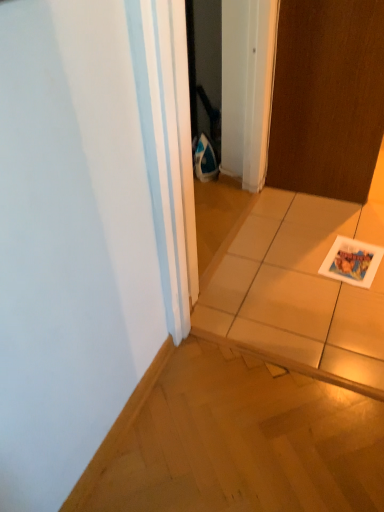
Question: From the image's perspective, is white glossy postcard at lower right located beneath white glossy tile at center?

Choices:
 (A) no
 (B) yes

Answer: (B)

Question: Could you tell me if white glossy postcard at lower right is turned towards white glossy tile at center?

Choices:
 (A) no
 (B) yes

Answer: (B)

Question: Is white glossy postcard at lower right taller than white glossy tile at center?

Choices:
 (A) yes
 (B) no

Answer: (B)

Question: Is white glossy postcard at lower right completely or partially outside of white glossy tile at center?

Choices:
 (A) yes
 (B) no

Answer: (B)

Question: From the image's perspective, is white glossy postcard at lower right above white glossy tile at center?

Choices:
 (A) yes
 (B) no

Answer: (B)

Question: Is white glossy tile at center surrounded by white glossy postcard at lower right?

Choices:
 (A) no
 (B) yes

Answer: (A)

Question: Is brown matte door at upper right smaller than white glossy tile at center?

Choices:
 (A) yes
 (B) no

Answer: (A)

Question: Can we say brown matte door at upper right lies outside white glossy tile at center?

Choices:
 (A) no
 (B) yes

Answer: (B)

Question: Is brown matte door at upper right oriented towards white glossy tile at center?

Choices:
 (A) no
 (B) yes

Answer: (B)

Question: From a real-world perspective, is brown matte door at upper right beneath white glossy tile at center?

Choices:
 (A) no
 (B) yes

Answer: (A)

Question: Is the surface of brown matte door at upper right in direct contact with white glossy tile at center?

Choices:
 (A) no
 (B) yes

Answer: (A)

Question: From the image's perspective, is brown matte door at upper right located beneath white glossy tile at center?

Choices:
 (A) yes
 (B) no

Answer: (B)

Question: Is white glossy tile at center outside of brown matte door at upper right?

Choices:
 (A) no
 (B) yes

Answer: (B)